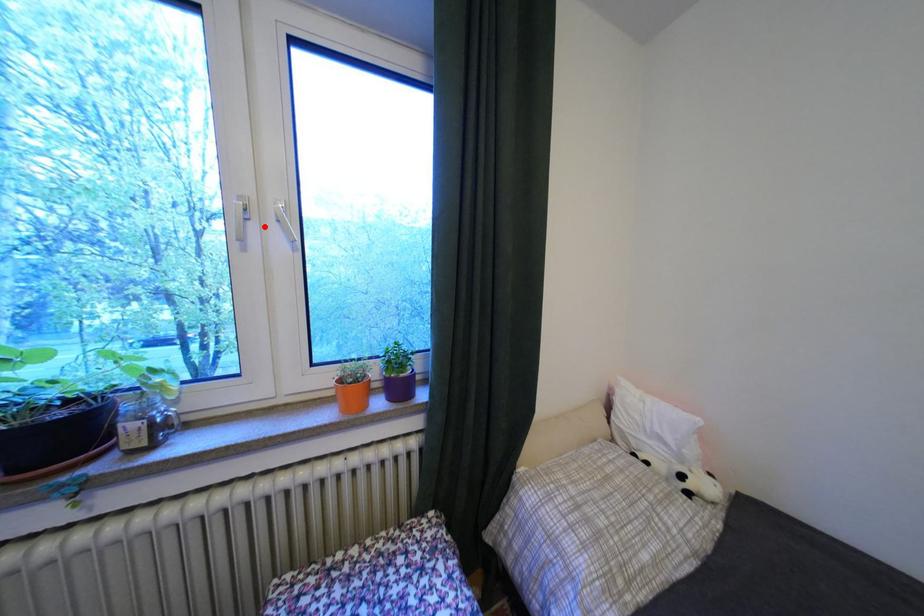
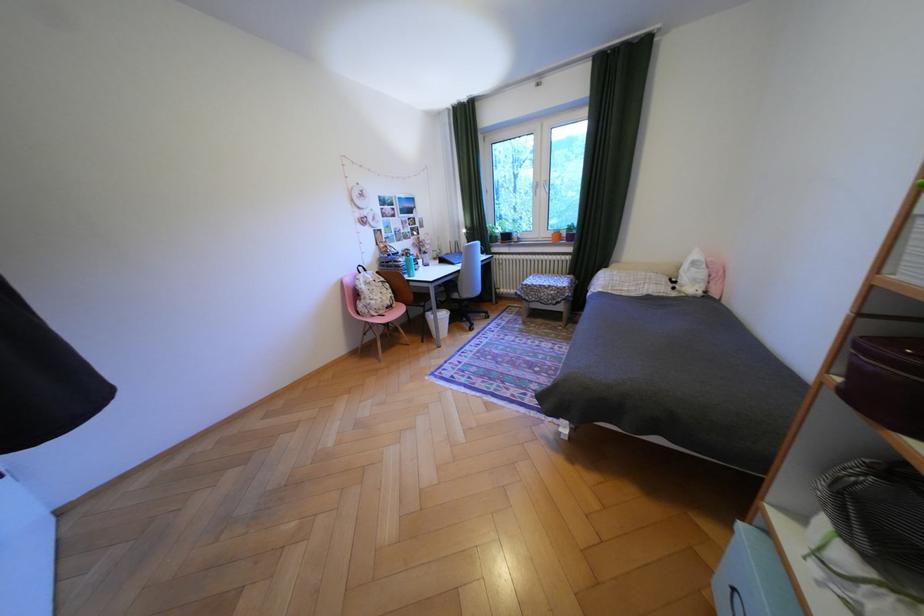
Question: A red point is marked in image1. In image2, is the corresponding 3D point closer to the camera or farther? Reply with the corresponding letter.

Choices:
 (A) The corresponding 3D point is closer.
 (B) The corresponding 3D point is farther.

Answer: (A)